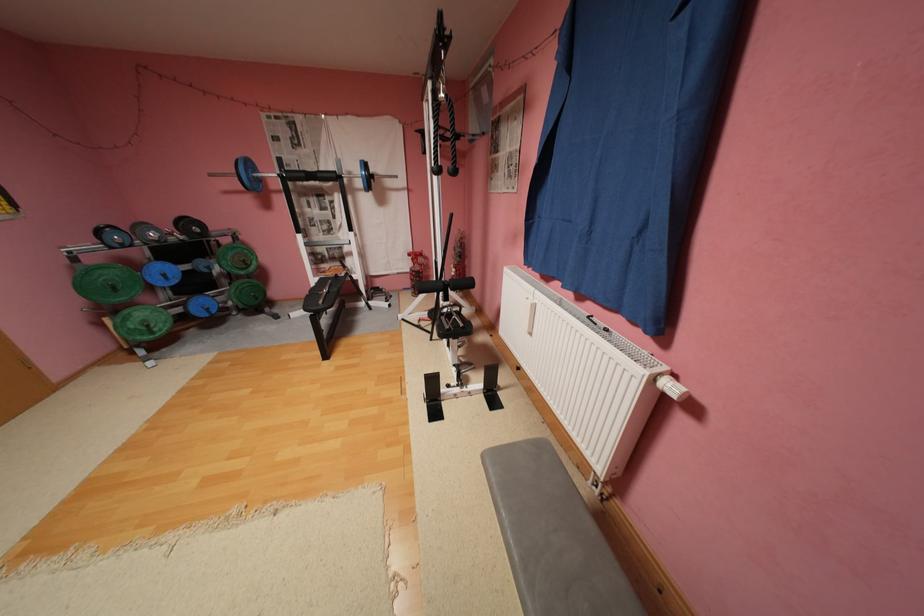
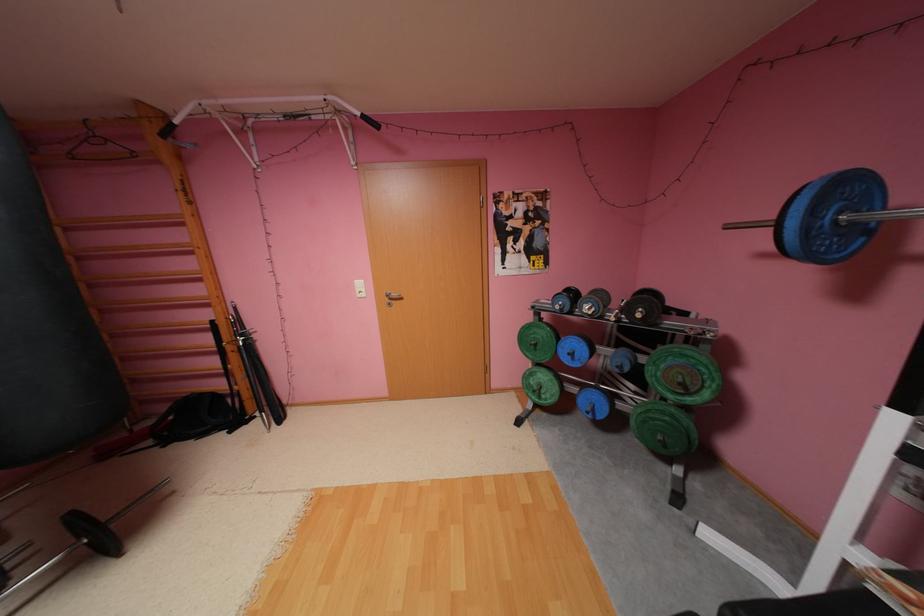
Find the pixel in the second image that matches point 253,261 in the first image.

(690, 384)